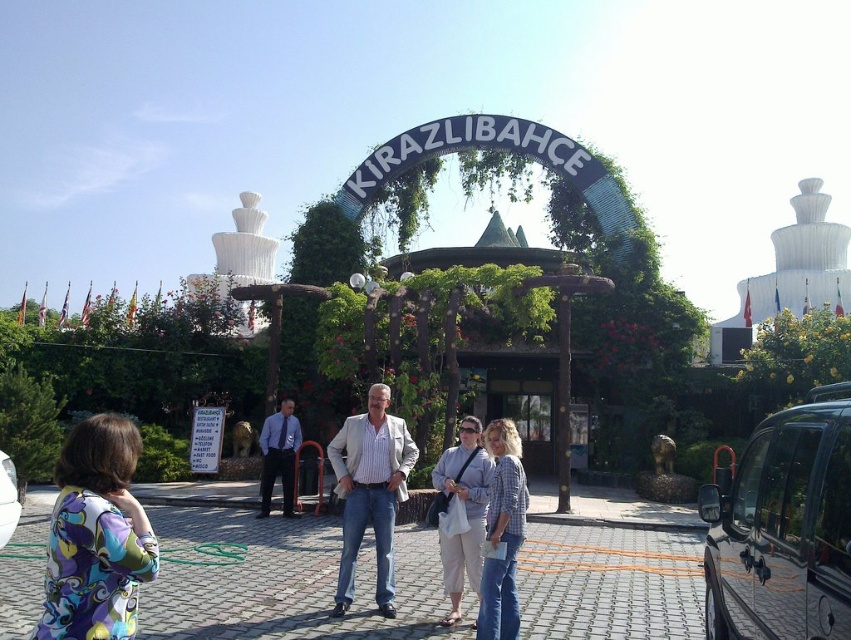
You are standing at the entrance of the park and see a man in a light blazer and jeans and the printed fabric dress at lower left. Which one is closer to you?

The printed fabric dress at lower left is closer to you since they are 164.67 feet apart.

You are a photographer taking a picture of the entrance of the park. You have the printed fabric dress at lower left and the striped cotton shirt at center in your viewfinder. Which one is closer to the camera?

The printed fabric dress at lower left is in front of the striped cotton shirt at center, so it is closer to the camera.